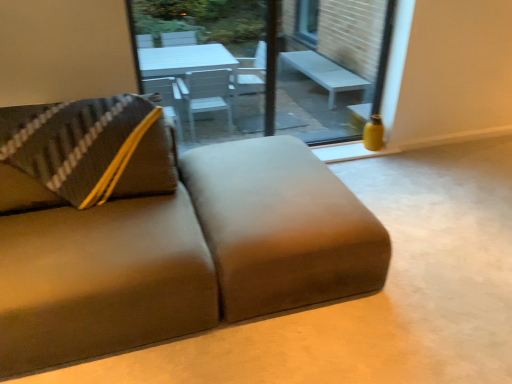
Question: Would you say suede-like brown studio couch at lower left is to the left or to the right of transparent glass window at center in the picture?

Choices:
 (A) left
 (B) right

Answer: (B)

Question: Considering the positions of suede-like brown studio couch at lower left and transparent glass window at center in the image, is suede-like brown studio couch at lower left bigger or smaller than transparent glass window at center?

Choices:
 (A) small
 (B) big

Answer: (B)

Question: Which object is the farthest from the transparent glass window at center?

Choices:
 (A) yellow matte vase at right
 (B) matte glass window screen at center
 (C) suede-like brown studio couch at lower left
 (D) suede-like beige footrest at lower center

Answer: (C)

Question: Based on their relative distances, which object is farther from the suede-like beige footrest at lower center?

Choices:
 (A) suede-like brown studio couch at lower left
 (B) matte glass window screen at center
 (C) transparent glass window at center
 (D) yellow matte vase at right

Answer: (B)